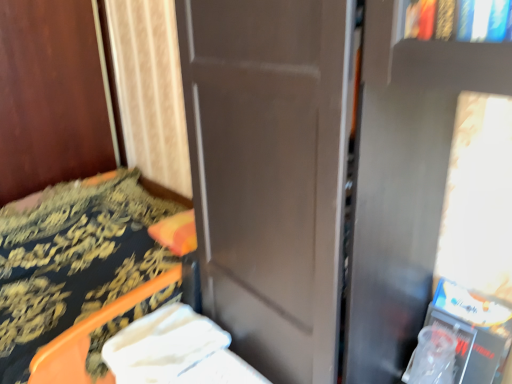
Question: Does white fabric at lower left appear on the right side of orange plastic chair at lower left?

Choices:
 (A) no
 (B) yes

Answer: (B)

Question: Is white fabric at lower left placed right next to orange plastic chair at lower left?

Choices:
 (A) yes
 (B) no

Answer: (B)

Question: Considering the relative sizes of white fabric at lower left and orange plastic chair at lower left in the image provided, is white fabric at lower left bigger than orange plastic chair at lower left?

Choices:
 (A) yes
 (B) no

Answer: (B)

Question: Does white fabric at lower left have a lesser height compared to orange plastic chair at lower left?

Choices:
 (A) no
 (B) yes

Answer: (B)

Question: From a real-world perspective, is white fabric at lower left on top of orange plastic chair at lower left?

Choices:
 (A) no
 (B) yes

Answer: (A)

Question: From a real-world perspective, is white fabric at lower left located beneath orange plastic chair at lower left?

Choices:
 (A) yes
 (B) no

Answer: (A)

Question: Does orange plastic chair at lower left turn towards white fabric at lower left?

Choices:
 (A) yes
 (B) no

Answer: (B)

Question: Can you confirm if orange plastic chair at lower left is taller than white fabric at lower left?

Choices:
 (A) no
 (B) yes

Answer: (B)

Question: Is orange plastic chair at lower left far from white fabric at lower left?

Choices:
 (A) no
 (B) yes

Answer: (A)

Question: From the image's perspective, is orange plastic chair at lower left on white fabric at lower left?

Choices:
 (A) no
 (B) yes

Answer: (B)

Question: Is orange plastic chair at lower left bigger than white fabric at lower left?

Choices:
 (A) yes
 (B) no

Answer: (A)

Question: From a real-world perspective, does orange plastic chair at lower left sit lower than white fabric at lower left?

Choices:
 (A) yes
 (B) no

Answer: (B)

Question: Is point (143, 360) closer or farther from the camera than point (142, 274)?

Choices:
 (A) closer
 (B) farther

Answer: (A)